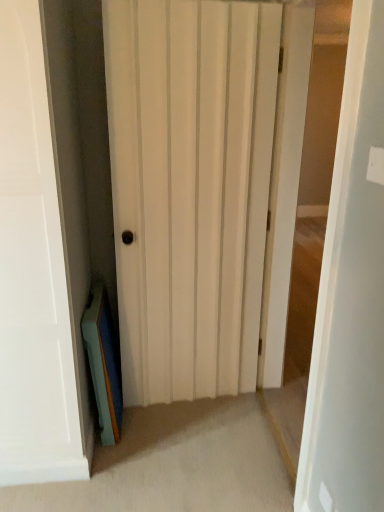
Question: Is teal matte book at lower left in front of white wood door at center, the second door viewed from the left?

Choices:
 (A) no
 (B) yes

Answer: (A)

Question: From the image's perspective, is teal matte book at lower left beneath white wood door at center, the 1th door when ordered from right to left?

Choices:
 (A) yes
 (B) no

Answer: (A)

Question: Can you confirm if teal matte book at lower left is wider than white wood door at center, the second door viewed from the left?

Choices:
 (A) yes
 (B) no

Answer: (B)

Question: Is teal matte book at lower left oriented towards white wood door at center, the 1th door when ordered from right to left?

Choices:
 (A) yes
 (B) no

Answer: (A)

Question: Does teal matte book at lower left have a lesser width compared to white wood door at center, the 1th door when ordered from right to left?

Choices:
 (A) yes
 (B) no

Answer: (A)

Question: Is white wood door at center, the second door viewed from the left, taller or shorter than white matte door at center, the 1th door in the left-to-right sequence?

Choices:
 (A) tall
 (B) short

Answer: (A)

Question: Is point (382, 236) closer or farther from the camera than point (258, 122)?

Choices:
 (A) closer
 (B) farther

Answer: (A)

Question: From a real-world perspective, is white wood door at center, the second door viewed from the left, positioned above or below white matte door at center, the second door viewed from the right?

Choices:
 (A) below
 (B) above

Answer: (B)

Question: Is white wood door at center, the 1th door when ordered from right to left, inside the boundaries of white matte door at center, the 1th door in the left-to-right sequence, or outside?

Choices:
 (A) inside
 (B) outside

Answer: (B)

Question: From the image's perspective, is white wood door at center, the 1th door when ordered from right to left, located above or below teal matte book at lower left?

Choices:
 (A) above
 (B) below

Answer: (A)

Question: In the image, is white wood door at center, the 1th door when ordered from right to left, on the left side or the right side of teal matte book at lower left?

Choices:
 (A) right
 (B) left

Answer: (A)

Question: Is white wood door at center, the second door viewed from the left, spatially inside teal matte book at lower left, or outside of it?

Choices:
 (A) inside
 (B) outside

Answer: (B)

Question: Is white wood door at center, the 1th door when ordered from right to left, wider or thinner than teal matte book at lower left?

Choices:
 (A) thin
 (B) wide

Answer: (B)

Question: From a real-world perspective, is teal matte book at lower left positioned above or below white wood door at center, the 1th door when ordered from right to left?

Choices:
 (A) above
 (B) below

Answer: (B)

Question: Is point (119, 413) positioned closer to the camera than point (337, 455)?

Choices:
 (A) farther
 (B) closer

Answer: (A)